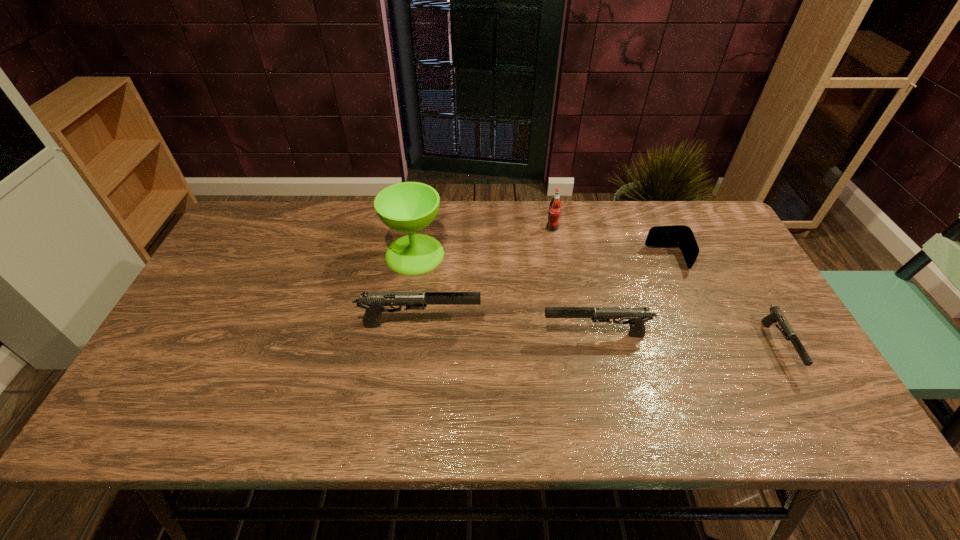
Find the location of a particular element. The width and height of the screenshot is (960, 540). wallet at the far edge is located at coordinates coord(680,236).

This screenshot has height=540, width=960. What are the coordinates of `wineglass that is at the far edge` in the screenshot? It's located at (408, 207).

Where is `object that is at the near edge`? The image size is (960, 540). object that is at the near edge is located at coordinates (776, 314).

The height and width of the screenshot is (540, 960). I want to click on object situated at the right edge, so click(776, 314).

Find the location of `object that is at the near right corner`. object that is at the near right corner is located at coordinates pos(776,314).

I want to click on vacant region at the far edge of the desktop, so click(324, 201).

Identify the location of vacant space at the near edge of the desktop. (612, 383).

In the image, there is a desktop. At what (x,y) coordinates should I click in order to perform the action: click on vacant space at the left edge. Please return your answer as a coordinate pair (x, y). Looking at the image, I should click on (229, 319).

You are a GUI agent. You are given a task and a screenshot of the screen. Output one action in this format:
    pyautogui.click(x=<x>, y=<y>)
    Task: Click on the free space at the far left corner of the desktop
    This screenshot has height=540, width=960.
    Given the screenshot: What is the action you would take?
    pyautogui.click(x=294, y=204)

The height and width of the screenshot is (540, 960). In the image, there is a desktop. In order to click on vacant area at the near left corner in this screenshot , I will do `click(205, 386)`.